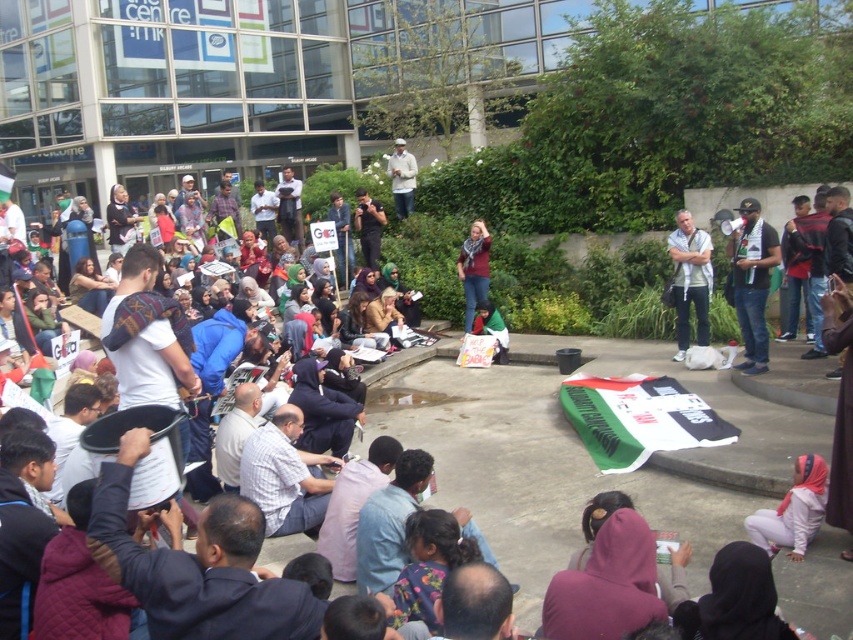
Consider the image. You are a photographer standing at the edge of the crowd holding a matte black camera at center. You want to take a photo of the modern building with large glass windows and signage in the background. Considering the distance between you and the building, will you need a telephoto lens to capture the entire building in one frame?

The distance between the photographer and the modern building with large glass windows and signage is 16.44 meters. A telephoto lens would help compress the perspective and capture the entire building in one frame from this distance.

Looking at this image, you are a photographer trying to capture a candid shot of the protest. You have a matte black camera at center and a white matte jacket at upper center in your frame. Which object would block the view of the other if they were positioned directly in front of each other?

The matte black camera at center is larger in size than the white matte jacket at upper center, so the matte black camera at center would block the view of the white matte jacket at upper center.